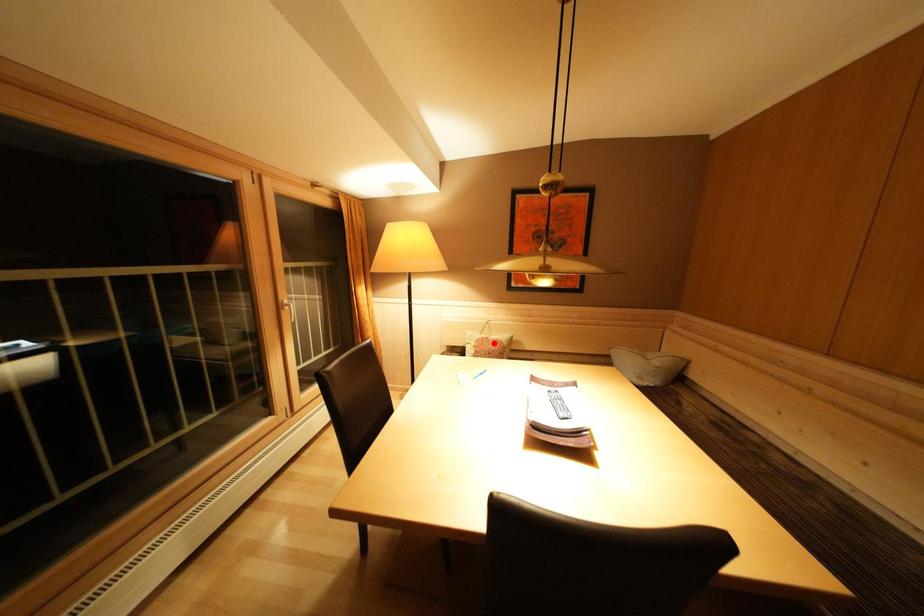
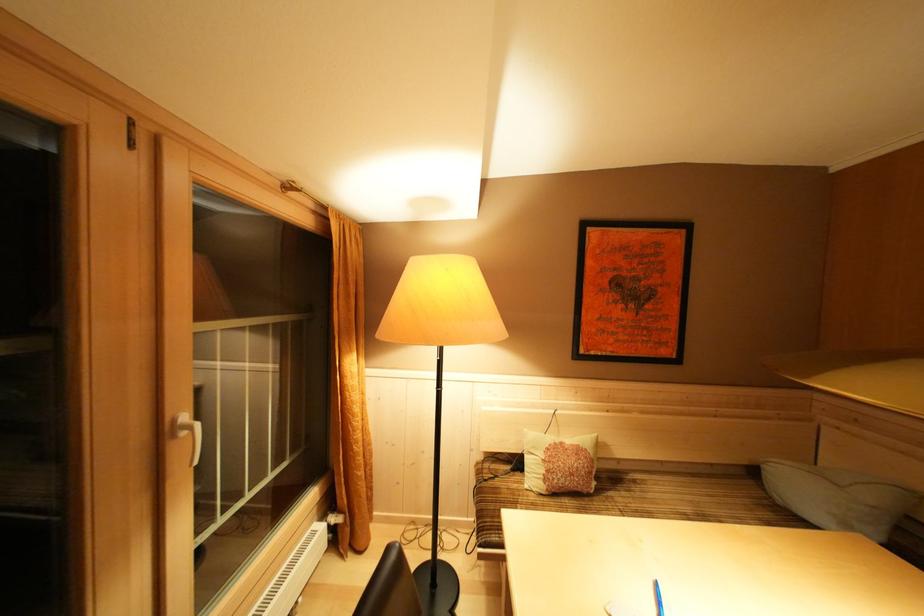
Locate, in the second image, the point that corresponds to the highlighted location in the first image.

(568, 448)